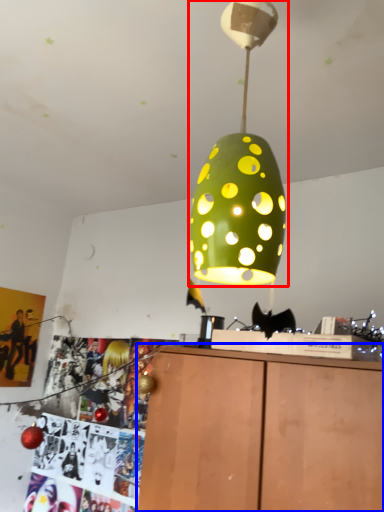
Question: Among these objects, which one is nearest to the camera, lamp (highlighted by a red box) or furniture (highlighted by a blue box)?

Choices:
 (A) lamp
 (B) furniture

Answer: (A)